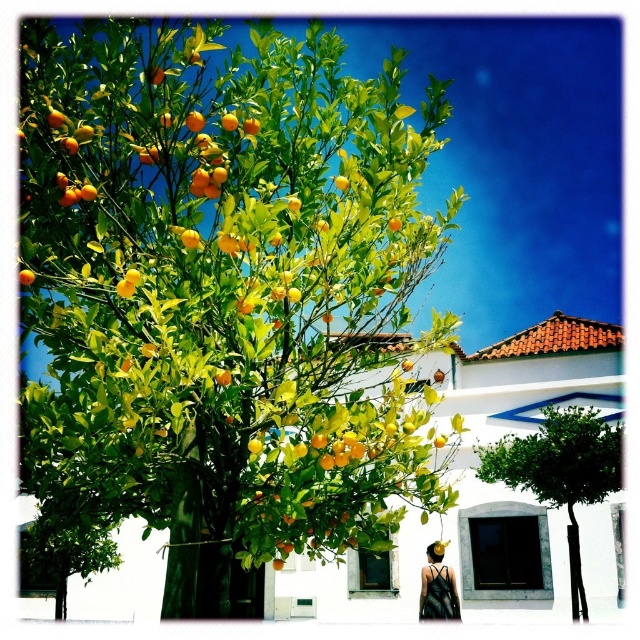
Question: Which point is closer to the camera?

Choices:
 (A) green leafy tree at center
 (B) green leafy fruit tree at center
 (C) matte black dress at lower right

Answer: (B)

Question: Is green leafy tree at center thinner than matte black dress at lower right?

Choices:
 (A) no
 (B) yes

Answer: (A)

Question: Which object appears closest to the camera in this image?

Choices:
 (A) green leafy fruit tree at center
 (B) green leafy tree at center
 (C) matte black dress at lower right

Answer: (A)

Question: Can you confirm if green leafy fruit tree at center is positioned to the right of matte black dress at lower right?

Choices:
 (A) yes
 (B) no

Answer: (B)

Question: Which point is farther to the camera?

Choices:
 (A) green leafy fruit tree at center
 (B) matte black dress at lower right

Answer: (B)

Question: Is green leafy fruit tree at center bigger than green leafy tree at center?

Choices:
 (A) yes
 (B) no

Answer: (A)